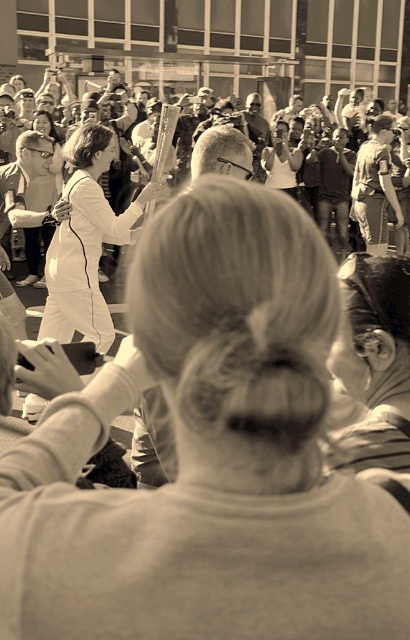
Question: Which of the following is the farthest from the observer?

Choices:
 (A) (56, 307)
 (B) (213, 160)

Answer: (A)

Question: Is white smooth dress at center positioned at the back of metallic torch at center?

Choices:
 (A) yes
 (B) no

Answer: (A)

Question: Which of the following is the closest to the observer?

Choices:
 (A) white smooth dress at center
 (B) metallic torch at center

Answer: (B)

Question: Is white smooth dress at center thinner than metallic torch at center?

Choices:
 (A) yes
 (B) no

Answer: (A)

Question: Is white smooth dress at center positioned behind metallic torch at center?

Choices:
 (A) yes
 (B) no

Answer: (A)